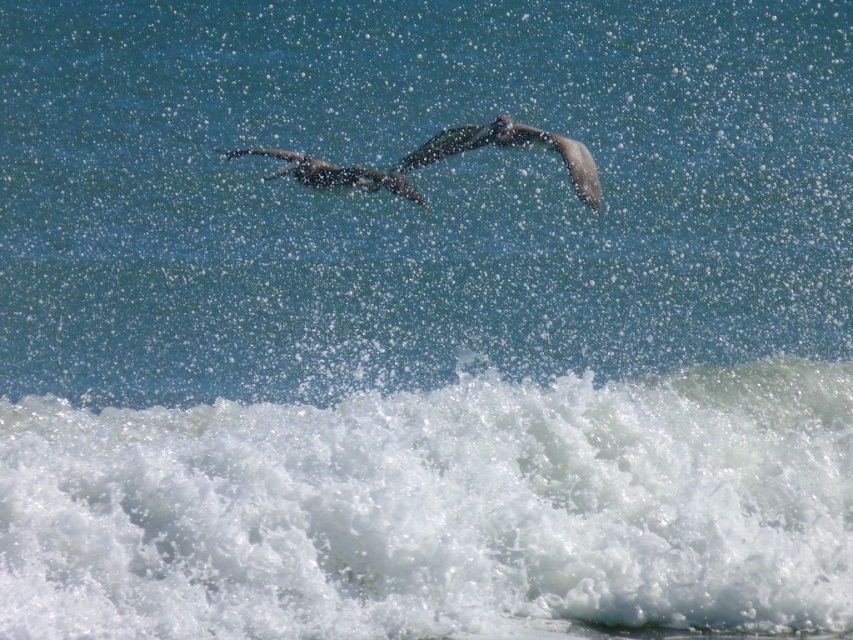
You are a photographer trying to capture the light brown feathered bird at upper center and the white frothy wave at lower center in a single shot. Based on their sizes in the image, which one will appear larger in the photo?

The light brown feathered bird at upper center will appear larger in the photo because the white frothy wave at lower center has a smaller size compared to it.

You are a photographer trying to capture the birds and the waves. You want to position your camera so that the smooth gray bird at center is directly to the right of the white frothy wave at lower center in the photo. Based on the scene description, is this possible?

Yes, because the white frothy wave at lower center is to the left of the smooth gray bird at center, positioning the bird to the right of the wave in the photo is achievable.